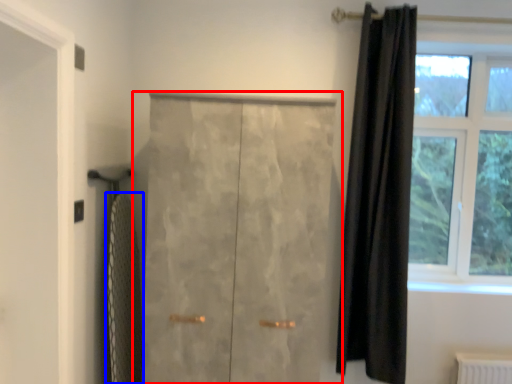
Question: Among these objects, which one is farthest to the camera, door (highlighted by a red box) or bath towel (highlighted by a blue box)?

Choices:
 (A) door
 (B) bath towel

Answer: (B)